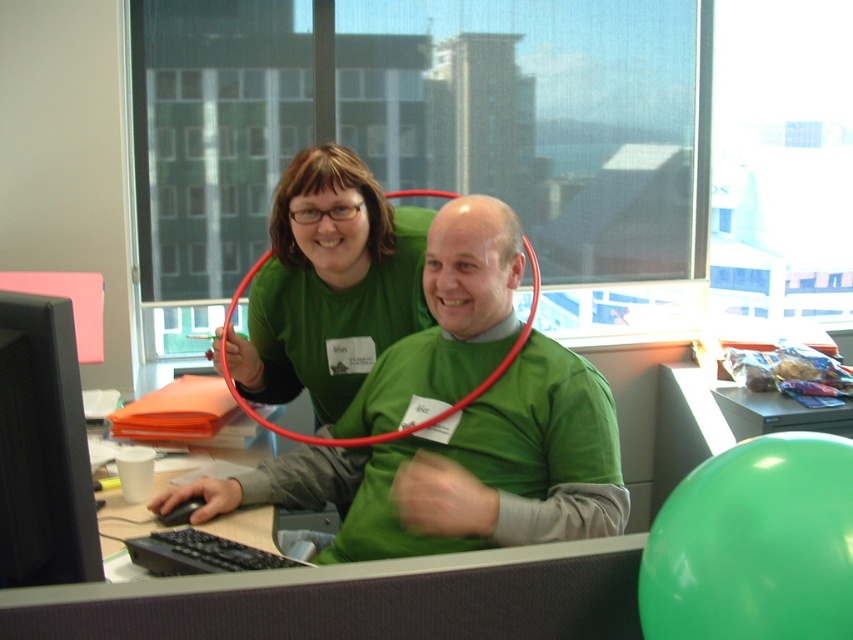
You are standing in front of the office desk and want to reach a point that is exactly at coordinates point (381, 362). If your arm can extend 1.5 meters, can you reach that point without moving your feet?

The distance of point (381, 362) from viewer is 1.88 meters, so your arm cannot reach it since it is 0.38 meters beyond your reach.

You are organizing a photoshoot and need to ensure that all items in the frame are visible. The green matte shirt at center and the black matte computer monitor at left are both in the shot. Based on their sizes, which item is more likely to block the view of the other if moved closer to the camera?

The green matte shirt at center might be wider than black matte computer monitor at left, so moving it closer could potentially block the monitor from view.